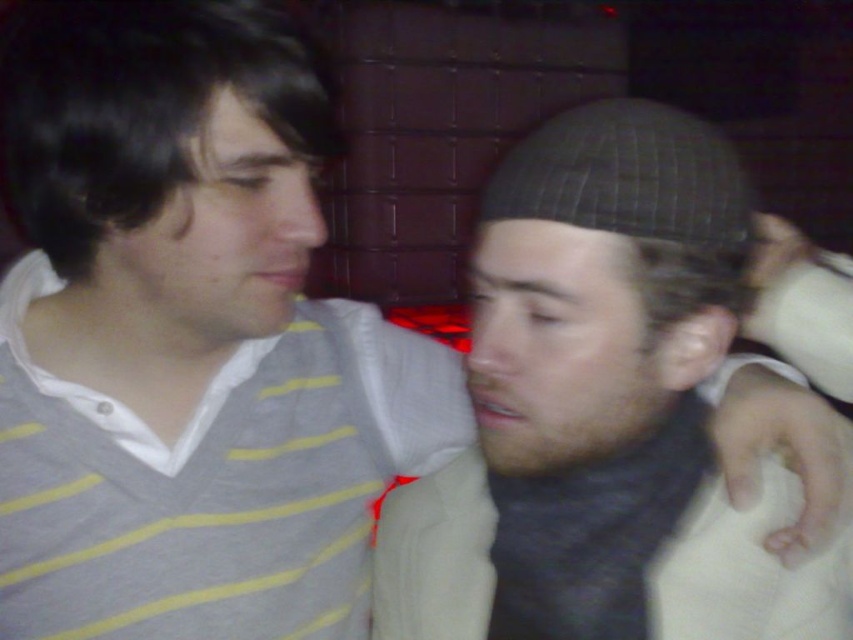
Question: Is dark gray knit cap at center to the left of black textured hat at center from the viewer's perspective?

Choices:
 (A) no
 (B) yes

Answer: (A)

Question: Which of the following is the farthest from the observer?

Choices:
 (A) black textured hat at center
 (B) dark gray knit cap at center

Answer: (A)

Question: Which of the following is the closest to the observer?

Choices:
 (A) dark gray knit cap at center
 (B) black textured hat at center

Answer: (A)

Question: Does dark gray knit cap at center have a smaller size compared to black textured hat at center?

Choices:
 (A) yes
 (B) no

Answer: (B)

Question: Can you confirm if dark gray knit cap at center is positioned below black textured hat at center?

Choices:
 (A) yes
 (B) no

Answer: (A)